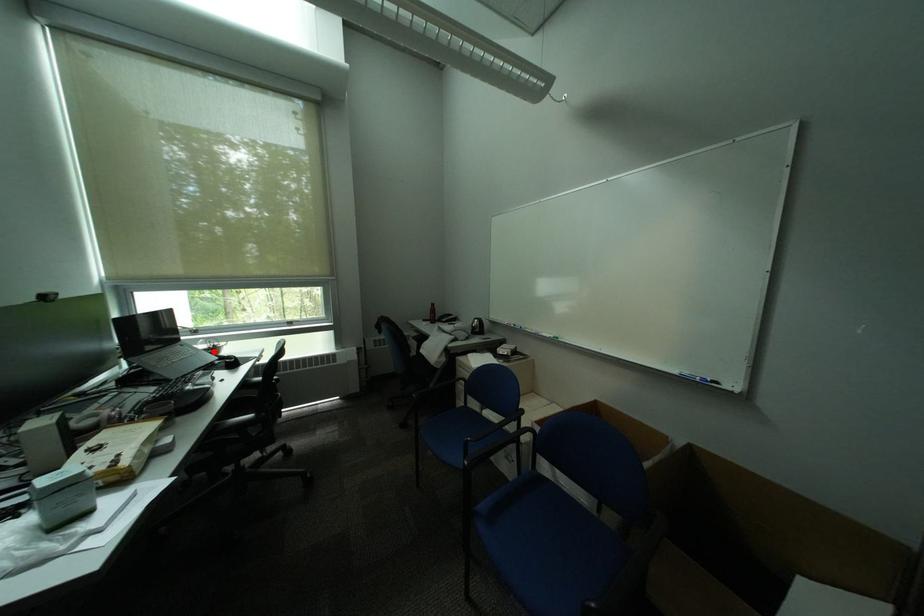
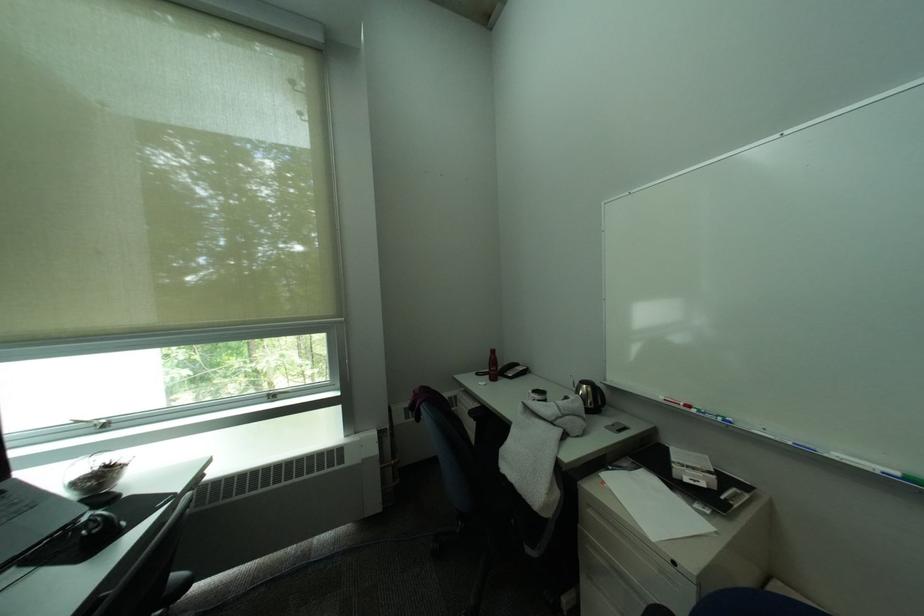
Where in the second image is the point corresponding to the highlighted location from the first image?

(84, 485)